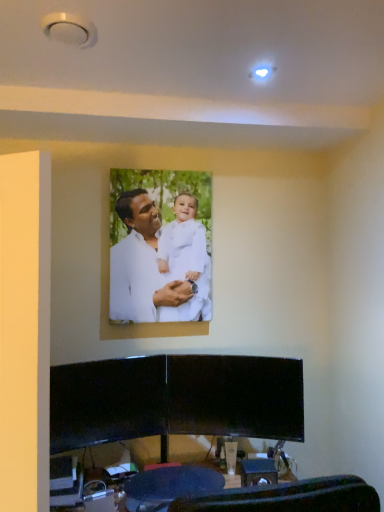
The image size is (384, 512). What do you see at coordinates (175, 399) in the screenshot?
I see `black glossy entertainment center at lower center` at bounding box center [175, 399].

Find the location of a particular element. This screenshot has width=384, height=512. black glossy entertainment center at lower center is located at coordinates (175, 399).

Identify the location of dark blue fabric swivel chair at lower center. (169, 486).

Based on the photo, does dark blue fabric swivel chair at lower center turn towards white matte/soft fabric man at center?

No, dark blue fabric swivel chair at lower center is not oriented towards white matte/soft fabric man at center.

Looking at their sizes, would you say dark blue fabric swivel chair at lower center is wider or thinner than white matte/soft fabric man at center?

Considering their sizes, dark blue fabric swivel chair at lower center looks broader than white matte/soft fabric man at center.

How much distance is there between dark blue fabric swivel chair at lower center and white matte/soft fabric man at center?

The distance of dark blue fabric swivel chair at lower center from white matte/soft fabric man at center is 32.81 inches.

Would you say white matte/soft fabric man at center is part of dark blue fabric swivel chair at lower center's contents?

That's incorrect, white matte/soft fabric man at center is not inside dark blue fabric swivel chair at lower center.

How different are the orientations of black glossy entertainment center at lower center and dark blue fabric swivel chair at lower center in degrees?

175 degrees separate the facing orientations of black glossy entertainment center at lower center and dark blue fabric swivel chair at lower center.

From a real-world perspective, is black glossy entertainment center at lower center physically below dark blue fabric swivel chair at lower center?

Actually, black glossy entertainment center at lower center is physically above dark blue fabric swivel chair at lower center in the real world.

From the picture: Is dark blue fabric swivel chair at lower center surrounded by black glossy entertainment center at lower center?

No.

Considering the positions of points (85, 446) and (220, 483), is point (85, 446) farther from camera compared to point (220, 483)?

Yes, point (85, 446) is farther from viewer.

Is point (206, 485) closer or farther from the camera than point (244, 392)?

Point (206, 485) is closer to the camera than point (244, 392).

How many degrees apart are the facing directions of dark blue fabric swivel chair at lower center and black glossy entertainment center at lower center?

There is a 175-degree angle between the facing directions of dark blue fabric swivel chair at lower center and black glossy entertainment center at lower center.

Can we say dark blue fabric swivel chair at lower center lies outside black glossy entertainment center at lower center?

Yes, dark blue fabric swivel chair at lower center is not within black glossy entertainment center at lower center.

Between dark blue fabric swivel chair at lower center and black glossy entertainment center at lower center, which one is positioned behind?

Positioned behind is dark blue fabric swivel chair at lower center.

Is dark blue fabric swivel chair at lower center completely or partially inside white matte/soft fabric man at center?

Definitely not — dark blue fabric swivel chair at lower center is not inside white matte/soft fabric man at center.

Who is shorter, white matte/soft fabric man at center or dark blue fabric swivel chair at lower center?

dark blue fabric swivel chair at lower center.

What's the angular difference between white matte/soft fabric man at center and dark blue fabric swivel chair at lower center's facing directions?

The facing directions of white matte/soft fabric man at center and dark blue fabric swivel chair at lower center are 2.78 degrees apart.

Is white matte/soft fabric man at center to the right of dark blue fabric swivel chair at lower center from the viewer's perspective?

Incorrect, white matte/soft fabric man at center is not on the right side of dark blue fabric swivel chair at lower center.

Is white matte/soft fabric man at center touching black glossy entertainment center at lower center?

white matte/soft fabric man at center and black glossy entertainment center at lower center are not in contact.

From the picture: From the image's perspective, which is above, white matte/soft fabric man at center or black glossy entertainment center at lower center?

white matte/soft fabric man at center appears higher in the image.

From a real-world perspective, which object rests below the other?

black glossy entertainment center at lower center, from a real-world perspective.

In the scene shown: Based on their positions, is white matte/soft fabric man at center located to the left or right of black glossy entertainment center at lower center?

white matte/soft fabric man at center is positioned on black glossy entertainment center at lower center's left side.

Is black glossy entertainment center at lower center far from white matte/soft fabric man at center?

black glossy entertainment center at lower center is near white matte/soft fabric man at center, not far away.

Is black glossy entertainment center at lower center taller than white matte/soft fabric man at center?

No, black glossy entertainment center at lower center is not taller than white matte/soft fabric man at center.

Which of these two, black glossy entertainment center at lower center or white matte/soft fabric man at center, is smaller?

white matte/soft fabric man at center is smaller.

Consider the image. Between black glossy entertainment center at lower center and white matte/soft fabric man at center, which one has larger width?

Wider between the two is black glossy entertainment center at lower center.

Locate an element on the screen. This screenshot has height=512, width=384. man that appears above the dark blue fabric swivel chair at lower center (from the image's perspective) is located at coordinates (151, 269).

What are the coordinates of `swivel chair on the left of black glossy entertainment center at lower center` in the screenshot? It's located at (169, 486).

Looking at the image, which one is located further to white matte/soft fabric man at center, black glossy entertainment center at lower center or dark blue fabric swivel chair at lower center?

dark blue fabric swivel chair at lower center.

When comparing their distances from black glossy entertainment center at lower center, does dark blue fabric swivel chair at lower center or white matte/soft fabric man at center seem further?

white matte/soft fabric man at center.

From the picture: Which object lies nearer to the anchor point white matte/soft fabric man at center, dark blue fabric swivel chair at lower center or black glossy entertainment center at lower center?

The object closer to white matte/soft fabric man at center is black glossy entertainment center at lower center.

From the image, which object appears to be farther from dark blue fabric swivel chair at lower center, black glossy entertainment center at lower center or white matte/soft fabric man at center?

The object further to dark blue fabric swivel chair at lower center is white matte/soft fabric man at center.

From the image, which object appears to be farther from dark blue fabric swivel chair at lower center, white matte/soft fabric man at center or black glossy entertainment center at lower center?

white matte/soft fabric man at center is positioned further to the anchor dark blue fabric swivel chair at lower center.

Which object lies nearer to the anchor point black glossy entertainment center at lower center, white matte/soft fabric man at center or dark blue fabric swivel chair at lower center?

The object closer to black glossy entertainment center at lower center is dark blue fabric swivel chair at lower center.

This screenshot has width=384, height=512. I want to click on swivel chair between black glossy entertainment center at lower center and white matte/soft fabric man at center from front to back, so click(x=169, y=486).